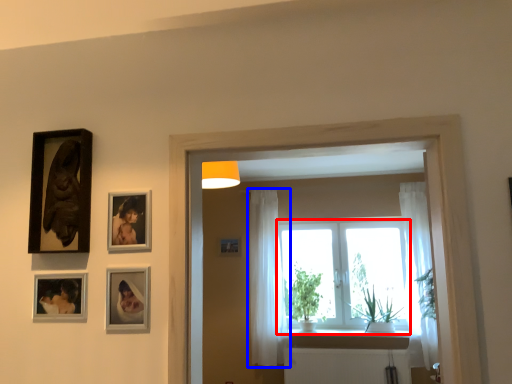
Question: Which of the following is the closest to the observer, window (highlighted by a red box) or curtain (highlighted by a blue box)?

Choices:
 (A) window
 (B) curtain

Answer: (B)